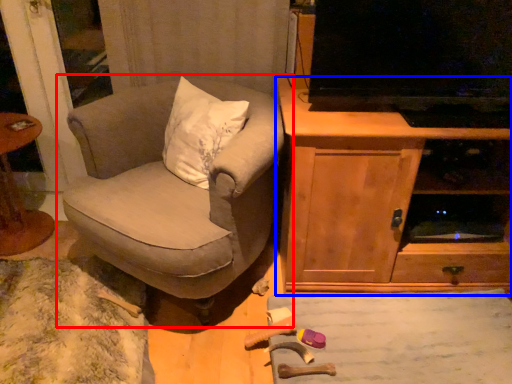
Question: Which of the following is the farthest to the observer, chair (highlighted by a red box) or cabinetry (highlighted by a blue box)?

Choices:
 (A) chair
 (B) cabinetry

Answer: (B)